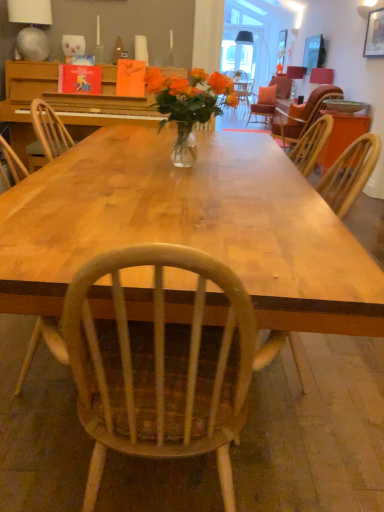
Question: From a real-world perspective, is matte pink lampshade at upper right, positioned as the second lamp in left-to-right order, on top of wooden table at right?

Choices:
 (A) yes
 (B) no

Answer: (A)

Question: Considering the relative positions of matte pink lampshade at upper right, which is the second lamp in top-to-bottom order, and wooden table at right in the image provided, is matte pink lampshade at upper right, which is the second lamp in top-to-bottom order, to the left of wooden table at right from the viewer's perspective?

Choices:
 (A) yes
 (B) no

Answer: (B)

Question: Is matte pink lampshade at upper right, which is the second lamp in top-to-bottom order, positioned in front of wooden table at right?

Choices:
 (A) no
 (B) yes

Answer: (A)

Question: Considering the relative sizes of matte pink lampshade at upper right, marked as the second lamp in a front-to-back arrangement, and wooden table at right in the image provided, is matte pink lampshade at upper right, marked as the second lamp in a front-to-back arrangement, wider than wooden table at right?

Choices:
 (A) yes
 (B) no

Answer: (B)

Question: Can you confirm if matte pink lampshade at upper right, which is counted as the 2th lamp, starting from the right, is shorter than wooden table at right?

Choices:
 (A) yes
 (B) no

Answer: (A)

Question: From the image's perspective, is matte white bowl at upper right positioned above or below translucent glass vase at center?

Choices:
 (A) above
 (B) below

Answer: (A)

Question: Considering the positions of matte white bowl at upper right and translucent glass vase at center in the image, is matte white bowl at upper right wider or thinner than translucent glass vase at center?

Choices:
 (A) thin
 (B) wide

Answer: (B)

Question: Based on their positions, is matte white bowl at upper right located to the left or right of translucent glass vase at center?

Choices:
 (A) left
 (B) right

Answer: (B)

Question: From a real-world perspective, relative to translucent glass vase at center, is matte white bowl at upper right vertically above or below?

Choices:
 (A) above
 (B) below

Answer: (B)

Question: Would you say hardcover book at upper left, which is counted as the 1th book, starting from the left, is to the left or to the right of matte wooden frame at upper right in the picture?

Choices:
 (A) left
 (B) right

Answer: (A)

Question: From a real-world perspective, is hardcover book at upper left, which is counted as the 1th book, starting from the left, above or below matte wooden frame at upper right?

Choices:
 (A) above
 (B) below

Answer: (B)

Question: Considering the positions of hardcover book at upper left, which ranks as the second book in right-to-left order, and matte wooden frame at upper right in the image, is hardcover book at upper left, which ranks as the second book in right-to-left order, wider or thinner than matte wooden frame at upper right?

Choices:
 (A) thin
 (B) wide

Answer: (B)

Question: Do you think hardcover book at upper left, which is counted as the 1th book, starting from the left, is within matte wooden frame at upper right, or outside of it?

Choices:
 (A) inside
 (B) outside

Answer: (B)

Question: Is matte black lampshade at upper center, placed as the third lamp when sorted from bottom to top, spatially inside translucent glass vase at center, or outside of it?

Choices:
 (A) outside
 (B) inside

Answer: (A)

Question: In the image, is matte black lampshade at upper center, placed as the 1th lamp when sorted from top to bottom, positioned in front of or behind translucent glass vase at center?

Choices:
 (A) front
 (B) behind

Answer: (B)